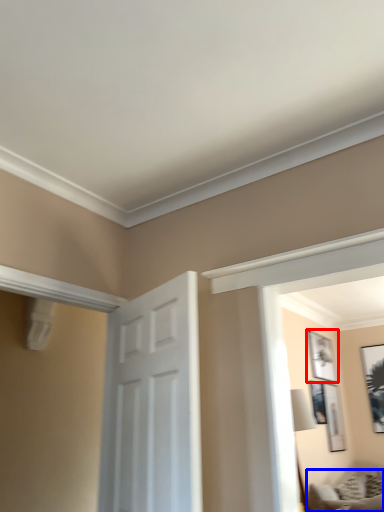
Question: Which object appears closest to the camera in this image, picture frame (highlighted by a red box) or furniture (highlighted by a blue box)?

Choices:
 (A) picture frame
 (B) furniture

Answer: (B)